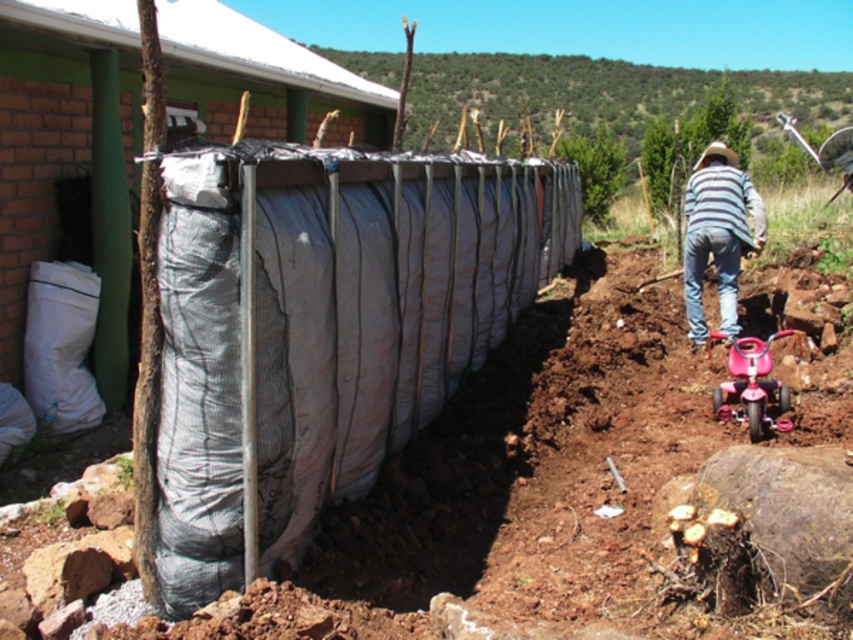
Question: Observing the image, what is the correct spatial positioning of striped cotton shirt at right in reference to pink plastic baby carriage at lower right?

Choices:
 (A) below
 (B) above

Answer: (B)

Question: Which point is farther to the camera?

Choices:
 (A) (761, 422)
 (B) (697, 260)

Answer: (B)

Question: Which point is farther to the camera?

Choices:
 (A) pink plastic baby carriage at lower right
 (B) striped cotton shirt at right

Answer: (B)

Question: Does striped cotton shirt at right have a smaller size compared to pink plastic baby carriage at lower right?

Choices:
 (A) yes
 (B) no

Answer: (B)

Question: Is striped cotton shirt at right to the right of pink plastic baby carriage at lower right from the viewer's perspective?

Choices:
 (A) yes
 (B) no

Answer: (A)